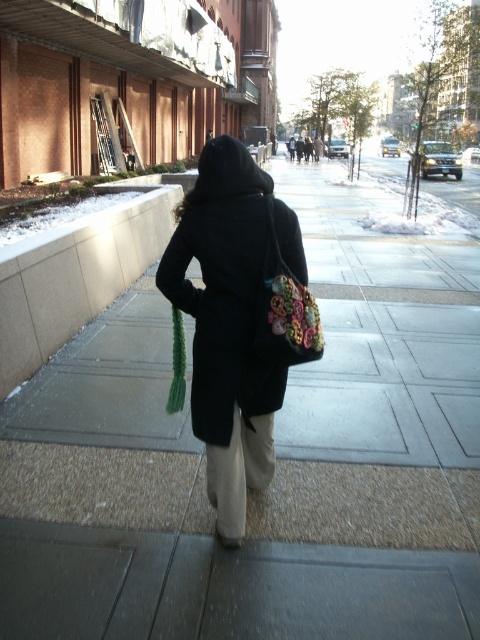
Question: Which of the following is the closest to the observer?

Choices:
 (A) (206, 403)
 (B) (307, 355)

Answer: (B)

Question: Can you confirm if black matte coat at center is bigger than floral fabric bag at back?

Choices:
 (A) no
 (B) yes

Answer: (B)

Question: Is black matte coat at center positioned before floral fabric bag at back?

Choices:
 (A) no
 (B) yes

Answer: (A)

Question: Which object appears farthest from the camera in this image?

Choices:
 (A) black matte coat at center
 (B) floral fabric bag at back

Answer: (A)

Question: Which object is closer to the camera taking this photo?

Choices:
 (A) black matte coat at center
 (B) floral fabric bag at back

Answer: (B)

Question: Can you confirm if black matte coat at center is smaller than floral fabric bag at back?

Choices:
 (A) yes
 (B) no

Answer: (B)